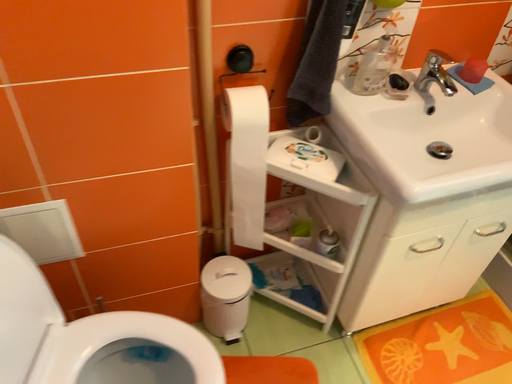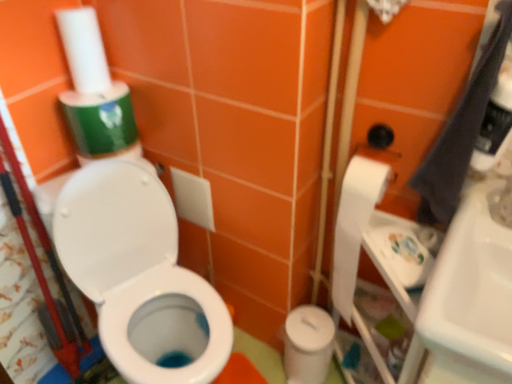
Question: How did the camera likely rotate when shooting the video?

Choices:
 (A) rotated right
 (B) rotated left

Answer: (B)